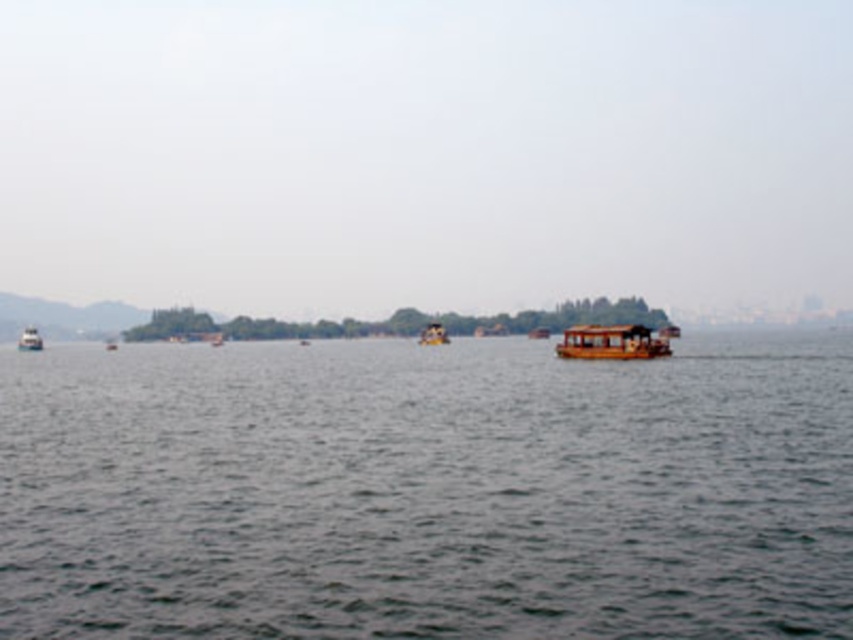
You are standing on the wooden boat at center and looking down. Can you see the dark gray water at center below you?

Yes, because the dark gray water at center is located below the wooden boat at center.

You are standing on the wooden boat at left and want to jump into the dark gray water at center. Is the water surface level higher or lower than the boat deck?

The dark gray water at center is not as tall as wooden boat at left, so the water surface is lower than the boat deck. You can jump safely.